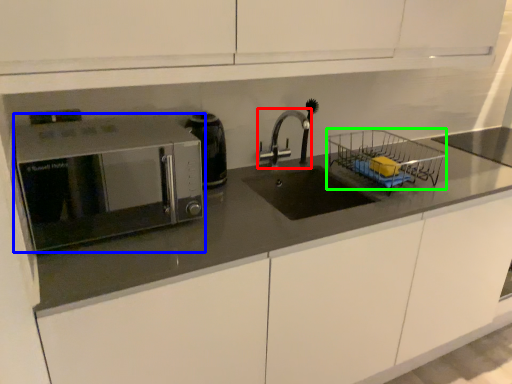
Question: Based on their relative distances, which object is farther from tap (highlighted by a red box)? Choose from microwave oven (highlighted by a blue box) and basket (highlighted by a green box).

Choices:
 (A) microwave oven
 (B) basket

Answer: (A)